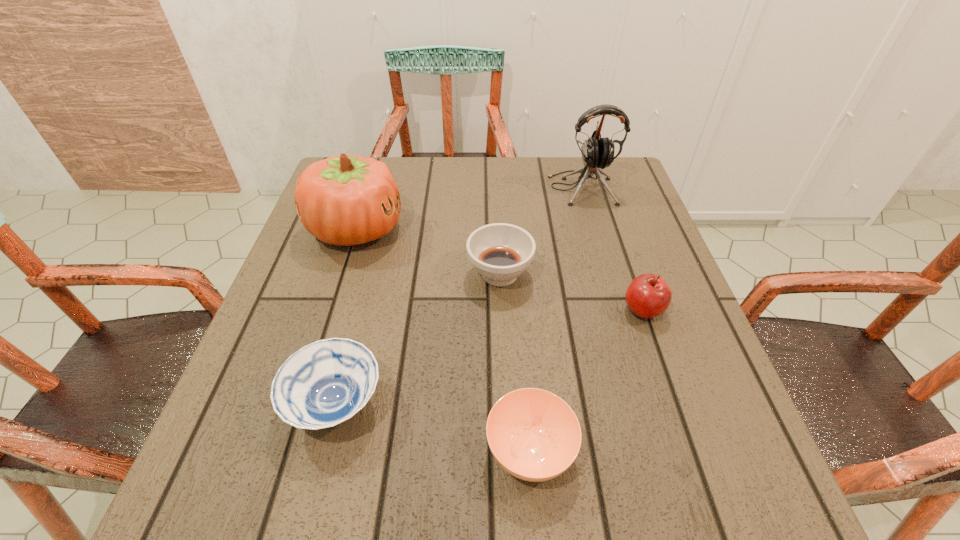
You are a GUI agent. You are given a task and a screenshot of the screen. Output one action in this format:
    pyautogui.click(x=<x>, y=<y>)
    Task: Click on the earphone
    
    Given the screenshot: What is the action you would take?
    pyautogui.click(x=597, y=152)

Image resolution: width=960 pixels, height=540 pixels. Find the location of `pumpkin`. pumpkin is located at coordinates (345, 200).

Image resolution: width=960 pixels, height=540 pixels. Identify the location of apple. (648, 295).

You are a GUI agent. You are given a task and a screenshot of the screen. Output one action in this format:
    pyautogui.click(x=<x>, y=<y>)
    Task: Click on the farthest soup bowl
    The height and width of the screenshot is (540, 960).
    Given the screenshot: What is the action you would take?
    pyautogui.click(x=500, y=252)

You are a GUI agent. You are given a task and a screenshot of the screen. Output one action in this format:
    pyautogui.click(x=<x>, y=<y>)
    Task: Click on the leftmost soup bowl
    This screenshot has height=540, width=960.
    Given the screenshot: What is the action you would take?
    pyautogui.click(x=325, y=383)

At what (x,y) coordinates should I click in order to perform the action: click on free region located 0.280m on the front of the earphone. Please return your answer as a coordinate pair (x, y). Image resolution: width=960 pixels, height=540 pixels. Looking at the image, I should click on click(611, 287).

Locate an element on the screen. This screenshot has height=540, width=960. vacant area situated on the side of the pumpkin with the cute face is located at coordinates (483, 229).

Where is `vacant space located on the left of the apple`? vacant space located on the left of the apple is located at coordinates (429, 309).

Find the location of a particular element. vacant position located on the right of the farthest soup bowl is located at coordinates (565, 274).

Locate an element on the screen. Image resolution: width=960 pixels, height=540 pixels. free space located on the right of the leftmost soup bowl is located at coordinates (543, 404).